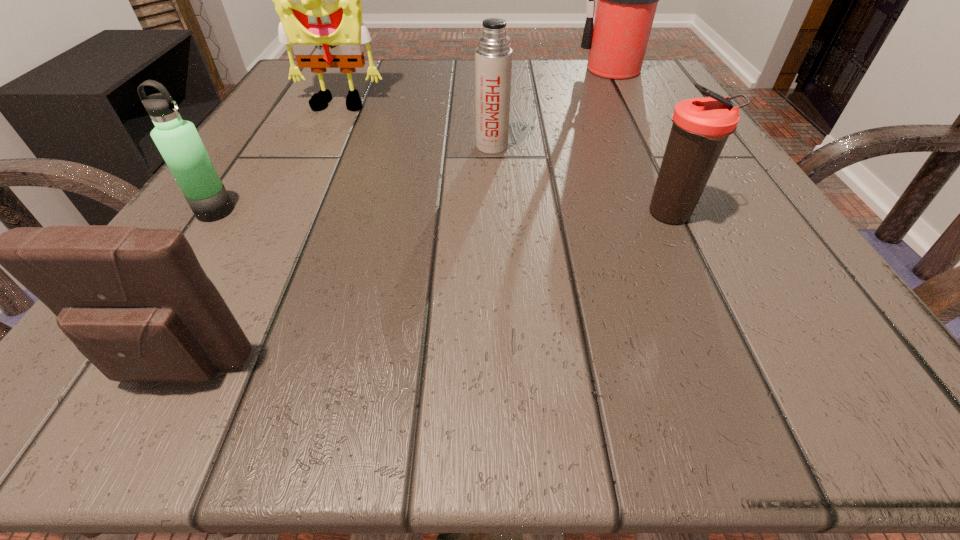
Image resolution: width=960 pixels, height=540 pixels. What are the coordinates of `vacant space at the right edge` in the screenshot? It's located at (638, 120).

Locate an element on the screen. Image resolution: width=960 pixels, height=540 pixels. free location at the far left corner is located at coordinates (296, 88).

This screenshot has height=540, width=960. In the image, there is a desktop. Identify the location of vacant region at the far right corner. (651, 109).

Locate an element on the screen. vacant area that lies between the fire extinguisher and the farthest thermos bottle is located at coordinates (554, 107).

The height and width of the screenshot is (540, 960). Identify the location of vacant space that is in between the rightmost thermos bottle and the pouch. (425, 293).

Identify the location of vacant space in between the fire extinguisher and the pouch. (397, 220).

In order to click on unoccupied area between the pouch and the third farthest object in this screenshot , I will do `click(335, 258)`.

I want to click on vacant area that lies between the rightmost thermos bottle and the leftmost thermos bottle, so click(444, 213).

The height and width of the screenshot is (540, 960). I want to click on vacant point located between the rightmost thermos bottle and the sponge, so click(x=504, y=161).

Image resolution: width=960 pixels, height=540 pixels. What are the coordinates of `vacant area that lies between the rightmost thermos bottle and the leftmost thermos bottle` in the screenshot? It's located at (444, 213).